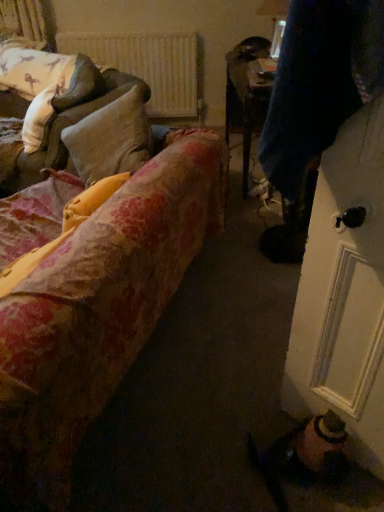
Question: Should I look upward or downward to see floral fabric couch at left, the 2th studio couch viewed from the front?

Choices:
 (A) up
 (B) down

Answer: (A)

Question: Are white textured radiator at upper center and white soft pillow at upper left located far from each other?

Choices:
 (A) no
 (B) yes

Answer: (B)

Question: Is white soft pillow at upper left located within white textured radiator at upper center?

Choices:
 (A) yes
 (B) no

Answer: (B)

Question: From a real-world perspective, is white textured radiator at upper center beneath white soft pillow at upper left?

Choices:
 (A) no
 (B) yes

Answer: (B)

Question: Is white textured radiator at upper center behind white soft pillow at upper left?

Choices:
 (A) no
 (B) yes

Answer: (B)

Question: From the image's perspective, is white textured radiator at upper center located beneath white soft pillow at upper left?

Choices:
 (A) yes
 (B) no

Answer: (B)

Question: Is white textured radiator at upper center thinner than white soft pillow at upper left?

Choices:
 (A) yes
 (B) no

Answer: (A)

Question: From the image's perspective, is white textured radiator at upper center located beneath velvet dark blue coat at right?

Choices:
 (A) no
 (B) yes

Answer: (A)

Question: Considering the relative sizes of white textured radiator at upper center and velvet dark blue coat at right in the image provided, is white textured radiator at upper center thinner than velvet dark blue coat at right?

Choices:
 (A) no
 (B) yes

Answer: (B)

Question: From the image's perspective, is white textured radiator at upper center above velvet dark blue coat at right?

Choices:
 (A) no
 (B) yes

Answer: (B)

Question: From a real-world perspective, is white textured radiator at upper center located higher than velvet dark blue coat at right?

Choices:
 (A) no
 (B) yes

Answer: (A)

Question: Considering the relative positions of white textured radiator at upper center and velvet dark blue coat at right in the image provided, is white textured radiator at upper center to the right of velvet dark blue coat at right from the viewer's perspective?

Choices:
 (A) no
 (B) yes

Answer: (A)

Question: Could you tell me if white textured radiator at upper center is turned towards velvet dark blue coat at right?

Choices:
 (A) yes
 (B) no

Answer: (A)

Question: Is velvet dark blue coat at right next to floral fabric couch at left, the first studio couch positioned from the back?

Choices:
 (A) yes
 (B) no

Answer: (B)